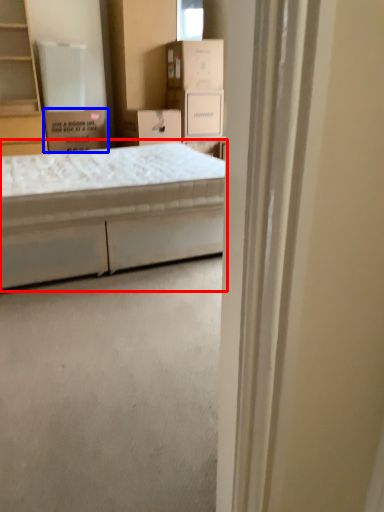
Question: Among these objects, which one is nearest to the camera, bed (highlighted by a red box) or cardboard box (highlighted by a blue box)?

Choices:
 (A) bed
 (B) cardboard box

Answer: (A)